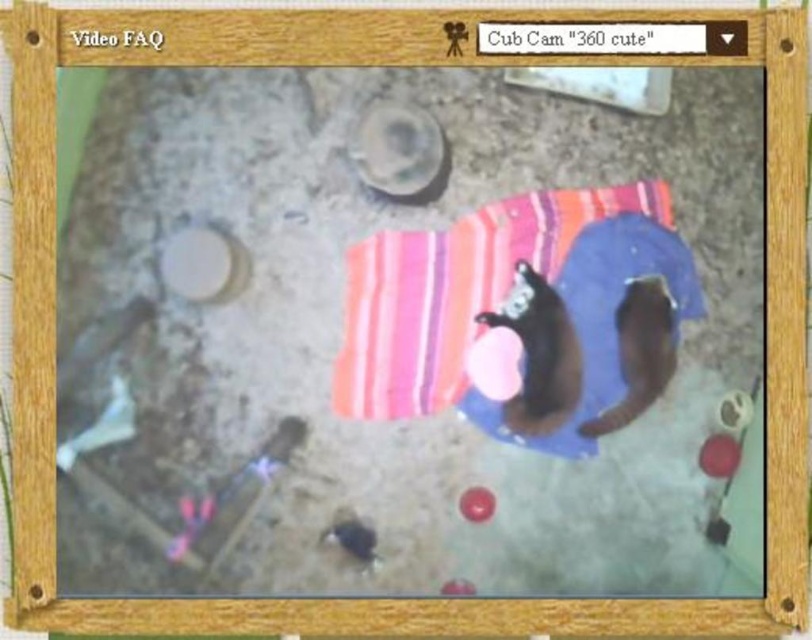
Does soft brown fur cat at center appear on the left side of rubber ball at center?

Incorrect, soft brown fur cat at center is not on the left side of rubber ball at center.

Who is shorter, soft brown fur cat at center or rubber ball at center?

With less height is rubber ball at center.

Who is more forward, (620, 426) or (471, 506)?

Point (471, 506) is in front.

Locate an element on the screen. This screenshot has height=640, width=812. soft brown fur cat at center is located at coordinates (638, 353).

Is black fur cat at center positioned before rubber ball at center?

No, it is behind rubber ball at center.

Can you confirm if black fur cat at center is wider than rubber ball at center?

Yes.

Which is behind, point (534, 417) or point (476, 488)?

Point (534, 417)

Where is `black fur cat at center`? Image resolution: width=812 pixels, height=640 pixels. black fur cat at center is located at coordinates (540, 356).

Which is in front, point (339, 384) or point (543, 426)?

Point (339, 384) is in front.

The image size is (812, 640). In order to click on striped cotton beach towel at center in this screenshot , I will do `click(452, 291)`.